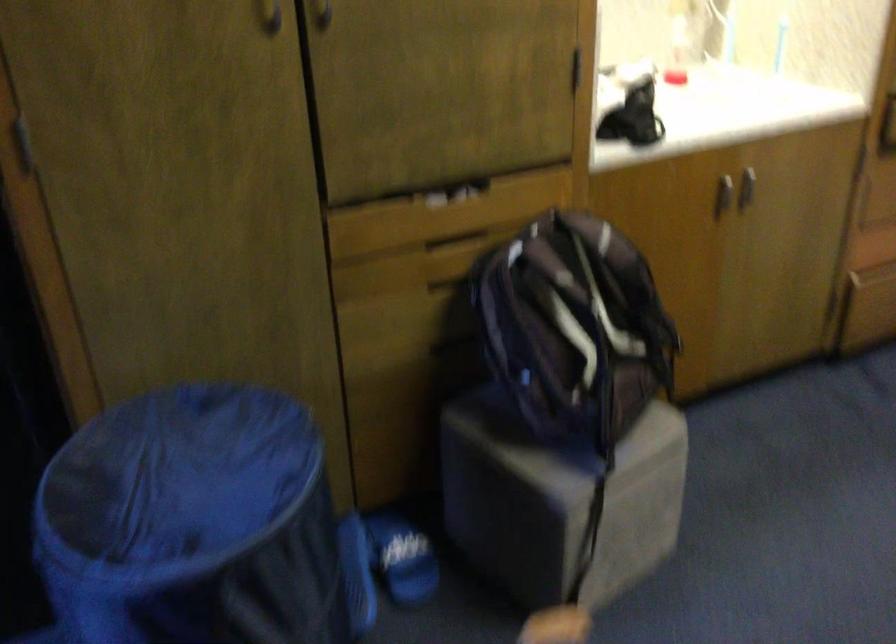
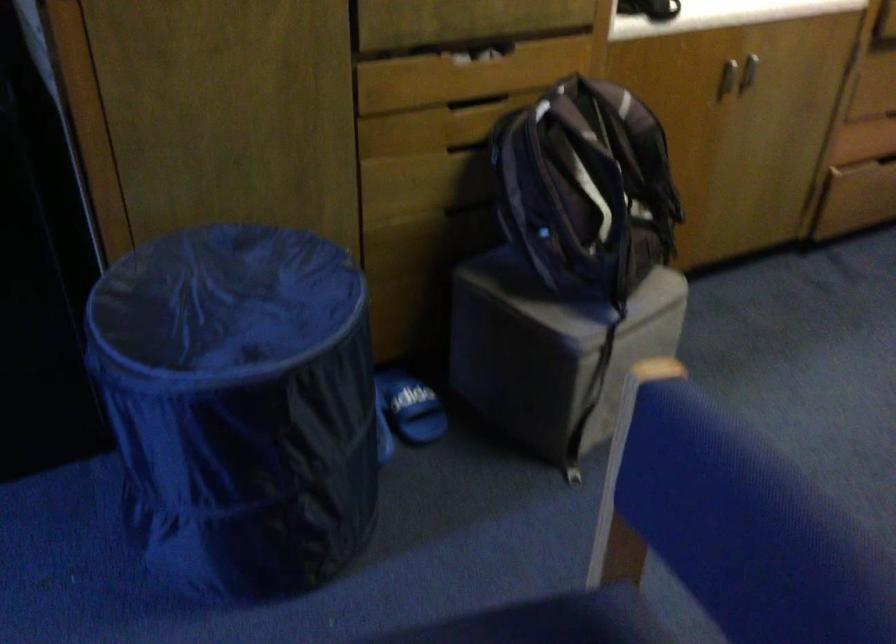
Locate, in the second image, the point that corresponds to (x=745, y=193) in the first image.

(748, 71)